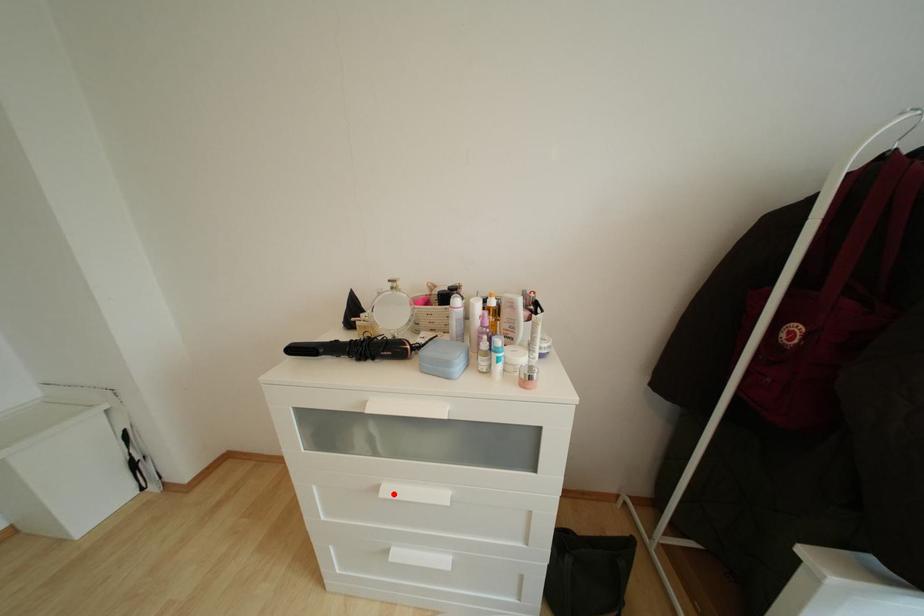
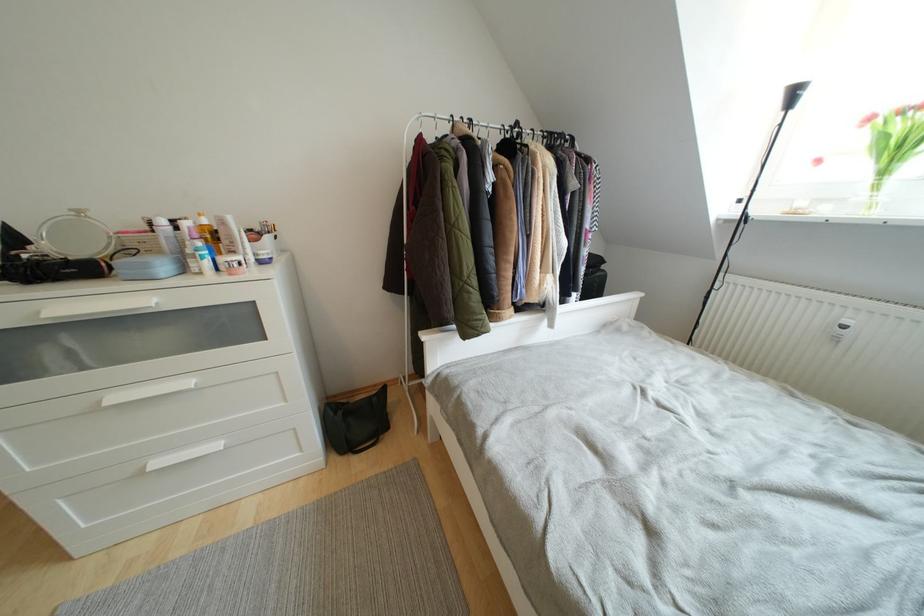
The point at the highlighted location is marked in the first image. Where is the corresponding point in the second image?

(120, 402)